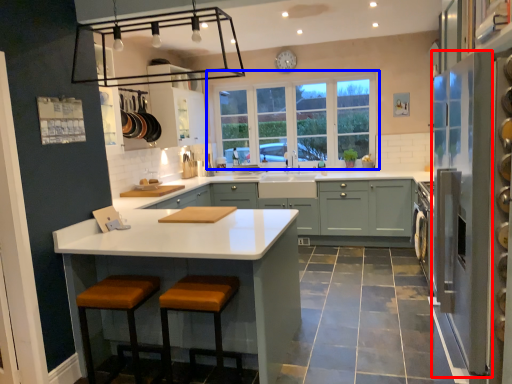
Question: Among these objects, which one is farthest to the camera, glass door (highlighted by a red box) or window (highlighted by a blue box)?

Choices:
 (A) glass door
 (B) window

Answer: (B)